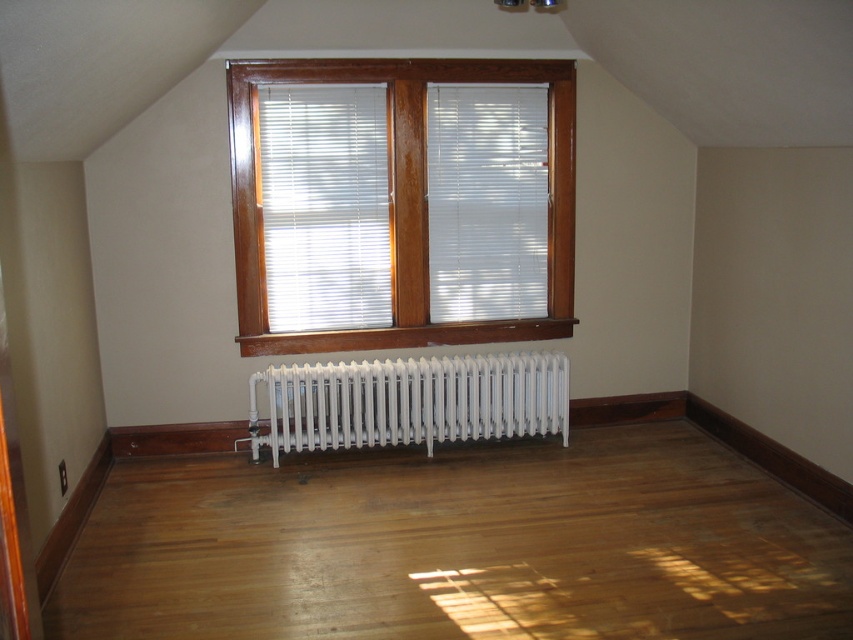
You are moving a heavy box across the shiny brown hardwood floor at center and need to avoid the white metallic radiator at center. According to the scene description, where should you position the box relative to the radiator?

The shiny brown hardwood floor at center is below the white metallic radiator at center, so you should position the box below the radiator to avoid it.

You are standing in the room and want to walk from the shiny brown hardwood floor at center to the white wood blinds at center. In which direction should you move?

You should move to the left, since the shiny brown hardwood floor at center is to the right of the white wood blinds at center.

You are standing in the room and want to take a photo of both point (76, 579) and point (427, 296). Which point should you focus on first to ensure both are in sharp focus?

You should focus on point (427, 296) first because it is farther from the camera than point (76, 579). By focusing on the farther point, the near point will also be within the depth of field.